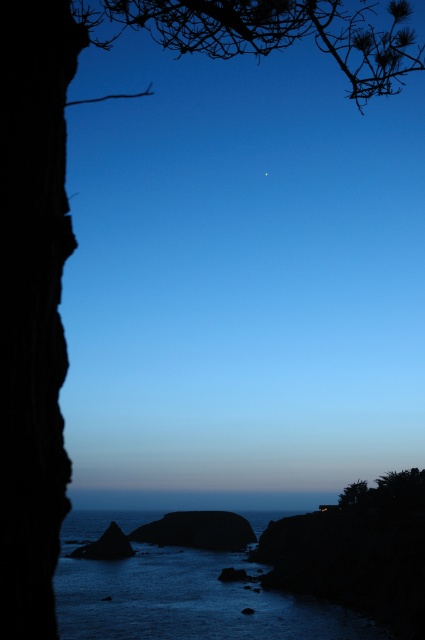
Question: Based on their relative distances, which object is nearer to the dark rock cliff at left?

Choices:
 (A) dark blue water at center
 (B) smooth gray rock at center

Answer: (A)

Question: Can you confirm if dark rock cliff at left is smaller than smooth dark rock at lower left?

Choices:
 (A) no
 (B) yes

Answer: (B)

Question: Is dark blue water at center bigger than smooth dark rock at lower left?

Choices:
 (A) no
 (B) yes

Answer: (B)

Question: Which of these objects is positioned closest to the smooth dark rock at lower left?

Choices:
 (A) smooth gray rock at center
 (B) dark blue water at center

Answer: (B)

Question: Which of the following is the closest to the observer?

Choices:
 (A) dark rock cliff at left
 (B) smooth gray rock at center

Answer: (A)

Question: Does dark blue water at center have a lesser width compared to smooth gray rock at center?

Choices:
 (A) no
 (B) yes

Answer: (A)